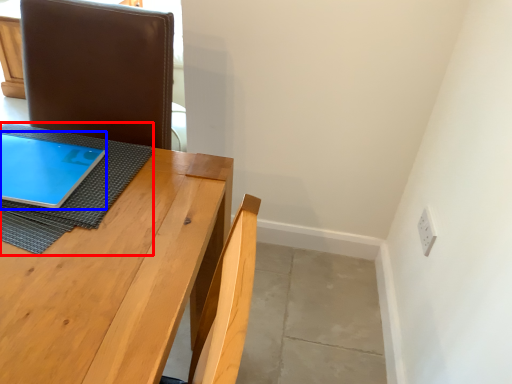
Question: Which of the following is the farthest to the observer, cloth (highlighted by a red box) or tablet computer (highlighted by a blue box)?

Choices:
 (A) cloth
 (B) tablet computer

Answer: (B)